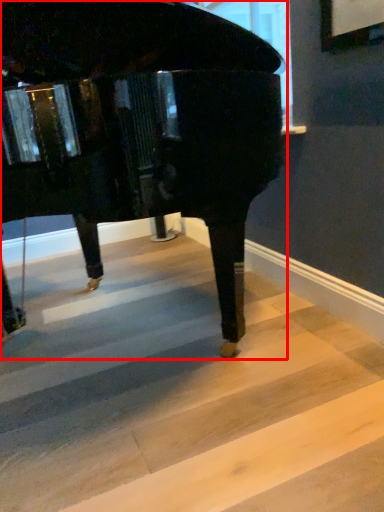
Question: From the image's perspective, where is piano (annotated by the red box) located relative to stairwell?

Choices:
 (A) below
 (B) above

Answer: (B)